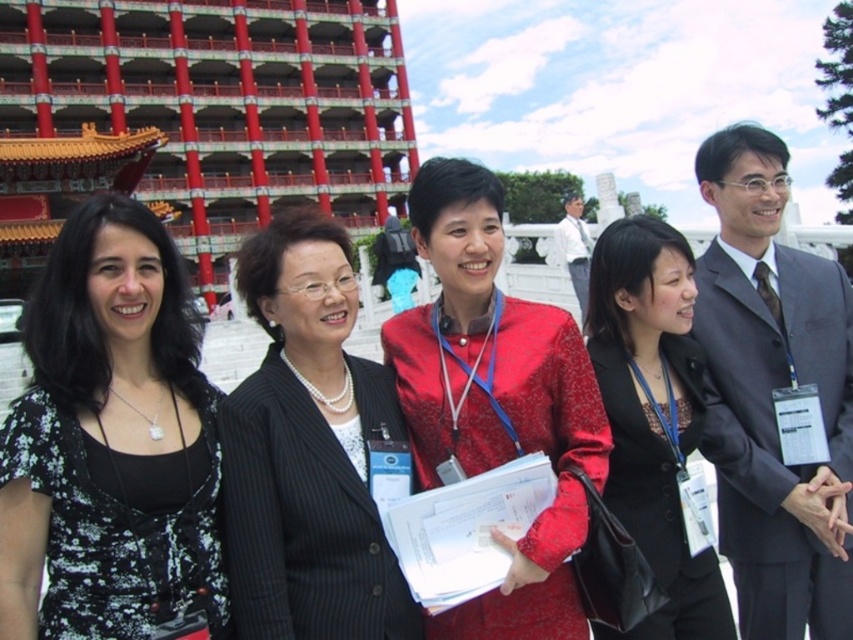
You are a photographer standing in front of the red painted stone palace at upper left and the black floral dress at left. You want to take a photo that includes both objects in focus. Which object should you focus on first to ensure both are sharp?

You should focus on the red painted stone palace at upper left first because it is closer to you than the black floral dress at left, so focusing on the closer object will help keep both in focus.

You are standing in front of the traditional East Asian building with red pillars. You notice a point marked at coordinates [109,442]. Based on the scene, can you determine what object or part of the scene this point corresponds to?

The point at coordinates [109,442] corresponds to the black floral dress at left.

You are standing at the center of the scene and want to hand a document to the person wearing the black floral dress at left. In which general direction should you walk to reach them?

The black floral dress at left is located at point 0.691 on the x axis and 0.129 on the y axis. Since you are at the center, which is typically at point 0.5 on both axes, moving towards the left and slightly downward would bring you closer to the black floral dress at left.